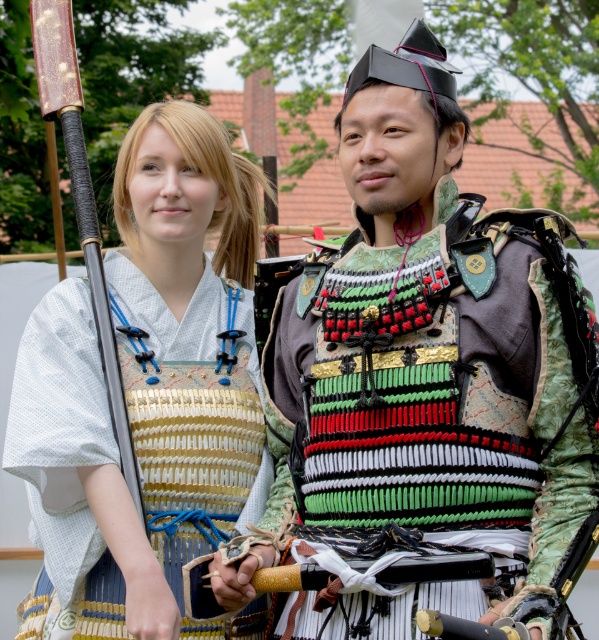
You are an artist trying to sketch the scene. You need to place the knitted fabric armor at center and the matte gold armor at center accurately. According to the image, which armor is positioned to the right side?

The knitted fabric armor at center is to the right of the matte gold armor at center.

You are an archer positioned at the origin point in the scene. You need to hit the knitted fabric armor at center with an arrow. What are the coordinates you should aim for?

You should aim for the coordinates point at (437, 397) to hit the knitted fabric armor at center.